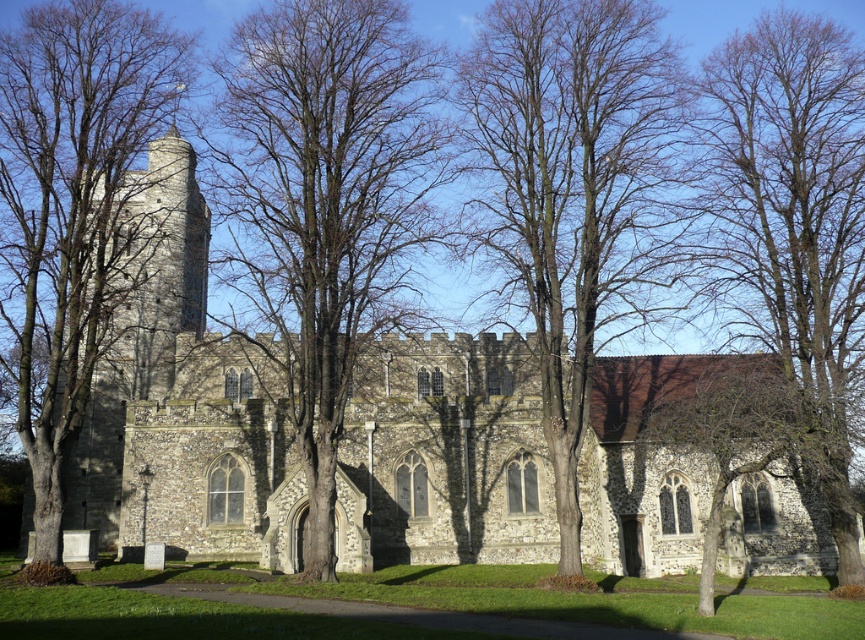
Is point (646, 186) more distant than point (93, 168)?

Yes, it is behind point (93, 168).

Who is more distant from viewer, (536, 252) or (58, 292)?

Positioned behind is point (536, 252).

Locate an element on the screen. Image resolution: width=865 pixels, height=640 pixels. bare wood tree at center is located at coordinates (574, 192).

Is point (273, 422) less distant than point (23, 307)?

Yes, point (273, 422) is closer to viewer.

Can you confirm if stone church at center is smaller than bare wood tree at left?

No, stone church at center is not smaller than bare wood tree at left.

Who is more distant from viewer, (122, 476) or (72, 305)?

Point (122, 476)

This screenshot has width=865, height=640. Find the location of `stone church at center`. stone church at center is located at coordinates (184, 410).

Which is more to the right, stone church at center or bare wood tree at center?

bare wood tree at center

Who is taller, stone church at center or bare wood tree at center?

bare wood tree at center is taller.

Based on the photo, who is more distant from viewer, (285, 422) or (596, 36)?

The point (285, 422) is behind.

You are a GUI agent. You are given a task and a screenshot of the screen. Output one action in this format:
    pyautogui.click(x=<x>, y=<y>)
    Task: Click on the stone church at center
    
    Given the screenshot: What is the action you would take?
    (x=184, y=410)